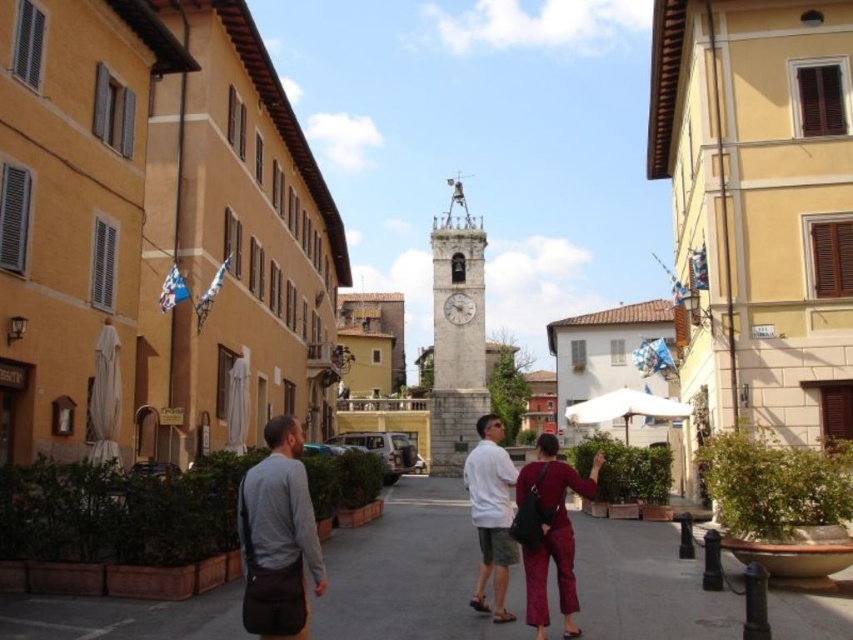
Question: Which point appears closest to the camera in this image?

Choices:
 (A) (248, 541)
 (B) (456, 508)
 (C) (552, 532)
 (D) (508, 566)

Answer: (A)

Question: Can you confirm if dark gray asphalt at center is thinner than gray fabric bag at lower left?

Choices:
 (A) no
 (B) yes

Answer: (A)

Question: Which point is farther from the camera taking this photo?

Choices:
 (A) 473,296
 (B) 514,560
 (C) 498,544

Answer: (A)

Question: Is stone clock tower at center bigger than white cotton shirt at center?

Choices:
 (A) no
 (B) yes

Answer: (B)

Question: From the image, what is the correct spatial relationship of stone clock tower at center in relation to gray fabric bag at lower left?

Choices:
 (A) right
 (B) left

Answer: (A)

Question: Which object appears farthest from the camera in this image?

Choices:
 (A) dark gray asphalt at center
 (B) white cotton shirt at center

Answer: (B)